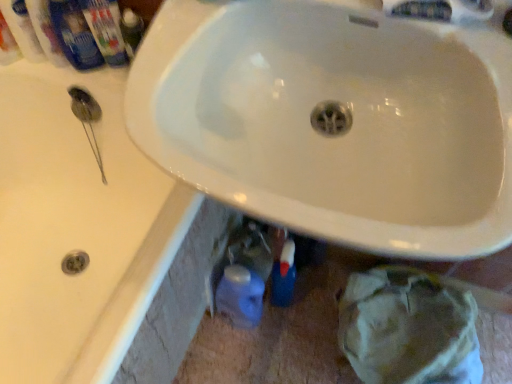
What is the approximate width of white glossy mouthwash at upper left, which is the second mouthwash in left-to-right order?

It is 2.99 inches.

The image size is (512, 384). Describe the element at coordinates (106, 29) in the screenshot. I see `matte plastic toothpaste tube at upper left` at that location.

The height and width of the screenshot is (384, 512). What do you see at coordinates (46, 32) in the screenshot?
I see `blue plastic mouthwash at upper left, the 3th mouthwash from the left` at bounding box center [46, 32].

Find the location of `blue plastic mouthwash at upper left, which ranks as the 2th mouthwash in right-to-left order`. blue plastic mouthwash at upper left, which ranks as the 2th mouthwash in right-to-left order is located at coordinates (46, 32).

Measure the distance between white plastic mouthwash at upper left, the 1th mouthwash when ordered from left to right, and camera.

white plastic mouthwash at upper left, the 1th mouthwash when ordered from left to right, and camera are 33.78 inches apart from each other.

Image resolution: width=512 pixels, height=384 pixels. What do you see at coordinates (7, 44) in the screenshot?
I see `white plastic mouthwash at upper left, the 1th mouthwash when ordered from left to right` at bounding box center [7, 44].

Locate an element on the screen. This screenshot has width=512, height=384. white glossy sink at center is located at coordinates click(340, 134).

In order to click on white glossy mouthwash at upper left, which is the second mouthwash in left-to-right order in this screenshot , I will do `click(23, 30)`.

Based on the photo, is blue plastic mouthwash at upper left, the 3th mouthwash from the left, bigger than blue plastic mouthwash at upper left, which is counted as the first mouthwash, starting from the right?

Correct, blue plastic mouthwash at upper left, the 3th mouthwash from the left, is larger in size than blue plastic mouthwash at upper left, which is counted as the first mouthwash, starting from the right.

Which of these two, blue plastic mouthwash at upper left, which ranks as the 2th mouthwash in right-to-left order, or blue plastic mouthwash at upper left, which appears as the 4th mouthwash when viewed from the left, stands taller?

Standing taller between the two is blue plastic mouthwash at upper left, which appears as the 4th mouthwash when viewed from the left.

Where is `mouthwash that is the 1st one above the blue plastic mouthwash at upper left, which ranks as the 2th mouthwash in right-to-left order (from a real-world perspective)`? The image size is (512, 384). mouthwash that is the 1st one above the blue plastic mouthwash at upper left, which ranks as the 2th mouthwash in right-to-left order (from a real-world perspective) is located at coordinates (74, 35).

How different are the orientations of blue plastic mouthwash at upper left, which ranks as the 2th mouthwash in right-to-left order, and blue plastic mouthwash at upper left, which is counted as the first mouthwash, starting from the right, in degrees?

The angle between the facing direction of blue plastic mouthwash at upper left, which ranks as the 2th mouthwash in right-to-left order, and the facing direction of blue plastic mouthwash at upper left, which is counted as the first mouthwash, starting from the right, is 0.000816 degrees.

Is white glossy sink at upper center oriented away from blue plastic mouthwash at upper left, the 3th mouthwash from the left?

That's not correct — white glossy sink at upper center is not looking away from blue plastic mouthwash at upper left, the 3th mouthwash from the left.

Is white glossy sink at upper center outside of blue plastic mouthwash at upper left, the 3th mouthwash from the left?

Yes.

From the image's perspective, relative to blue plastic mouthwash at upper left, which ranks as the 2th mouthwash in right-to-left order, is white glossy sink at upper center above or below?

white glossy sink at upper center is below blue plastic mouthwash at upper left, which ranks as the 2th mouthwash in right-to-left order.

Is white glossy sink at upper center in contact with blue plastic mouthwash at upper left, the 3th mouthwash from the left?

white glossy sink at upper center and blue plastic mouthwash at upper left, the 3th mouthwash from the left, are not in contact.

Who is more distant, white glossy mouthwash at upper left, the 3th mouthwash when ordered from right to left, or white plastic mouthwash at upper left, the 1th mouthwash when ordered from left to right?

white glossy mouthwash at upper left, the 3th mouthwash when ordered from right to left, is further from the camera.

Considering the positions of objects white glossy mouthwash at upper left, the 3th mouthwash when ordered from right to left, and white plastic mouthwash at upper left, acting as the 4th mouthwash starting from the right, in the image provided, who is more to the left, white glossy mouthwash at upper left, the 3th mouthwash when ordered from right to left, or white plastic mouthwash at upper left, acting as the 4th mouthwash starting from the right,?

white plastic mouthwash at upper left, acting as the 4th mouthwash starting from the right, is more to the left.

Is white glossy mouthwash at upper left, which is the second mouthwash in left-to-right order, bigger than white plastic mouthwash at upper left, the 1th mouthwash when ordered from left to right?

Yes, white glossy mouthwash at upper left, which is the second mouthwash in left-to-right order, is bigger than white plastic mouthwash at upper left, the 1th mouthwash when ordered from left to right.

Is white plastic mouthwash at upper left, acting as the 4th mouthwash starting from the right, positioned beyond the bounds of matte plastic toothpaste tube at upper left?

Yes, white plastic mouthwash at upper left, acting as the 4th mouthwash starting from the right, is not within matte plastic toothpaste tube at upper left.

Between white plastic mouthwash at upper left, acting as the 4th mouthwash starting from the right, and matte plastic toothpaste tube at upper left, which one has larger size?

Bigger between the two is matte plastic toothpaste tube at upper left.

Is white plastic mouthwash at upper left, the 1th mouthwash when ordered from left to right, thinner than matte plastic toothpaste tube at upper left?

Indeed, white plastic mouthwash at upper left, the 1th mouthwash when ordered from left to right, has a lesser width compared to matte plastic toothpaste tube at upper left.

Is white plastic mouthwash at upper left, the 1th mouthwash when ordered from left to right, turned away from matte plastic toothpaste tube at upper left?

white plastic mouthwash at upper left, the 1th mouthwash when ordered from left to right, is not turned away from matte plastic toothpaste tube at upper left.

In the image, is white glossy sink at upper center positioned in front of or behind white glossy mouthwash at upper left, which is the second mouthwash in left-to-right order?

Clearly, white glossy sink at upper center is in front of white glossy mouthwash at upper left, which is the second mouthwash in left-to-right order.

Measure the distance between white glossy sink at upper center and white glossy mouthwash at upper left, which is the second mouthwash in left-to-right order.

They are 13.35 inches apart.

Is white glossy sink at upper center to the left of white glossy mouthwash at upper left, the 3th mouthwash when ordered from right to left, from the viewer's perspective?

No.

Based on the photo, considering the sizes of objects white glossy mouthwash at upper left, which is the second mouthwash in left-to-right order, and white glossy sink at center in the image provided, who is shorter, white glossy mouthwash at upper left, which is the second mouthwash in left-to-right order, or white glossy sink at center?

Standing shorter between the two is white glossy mouthwash at upper left, which is the second mouthwash in left-to-right order.

Is point (12, 1) closer to viewer compared to point (445, 45)?

No, (12, 1) is further to viewer.

Is the surface of white glossy mouthwash at upper left, the 3th mouthwash when ordered from right to left, in direct contact with white glossy sink at center?

No, white glossy mouthwash at upper left, the 3th mouthwash when ordered from right to left, is not in contact with white glossy sink at center.

How different are the orientations of white glossy mouthwash at upper left, the 3th mouthwash when ordered from right to left, and blue plastic mouthwash at upper left, the 3th mouthwash from the left, in degrees?

The facing directions of white glossy mouthwash at upper left, the 3th mouthwash when ordered from right to left, and blue plastic mouthwash at upper left, the 3th mouthwash from the left, are 0.000128 degrees apart.

I want to click on mouthwash lying behind the white glossy mouthwash at upper left, the 3th mouthwash when ordered from right to left, so (x=46, y=32).

Is blue plastic mouthwash at upper left, which ranks as the 2th mouthwash in right-to-left order, at the back of white glossy mouthwash at upper left, which is the second mouthwash in left-to-right order?

No, white glossy mouthwash at upper left, which is the second mouthwash in left-to-right order,'s orientation is not away from blue plastic mouthwash at upper left, which ranks as the 2th mouthwash in right-to-left order.

Does white glossy mouthwash at upper left, which is the second mouthwash in left-to-right order, lie in front of blue plastic mouthwash at upper left, which ranks as the 2th mouthwash in right-to-left order?

Yes, white glossy mouthwash at upper left, which is the second mouthwash in left-to-right order, is closer to the viewer.

You are a GUI agent. You are given a task and a screenshot of the screen. Output one action in this format:
    pyautogui.click(x=<x>, y=<y>)
    Task: Click on the 1st mouthwash counting from the left side of the blue plastic mouthwash at upper left, which appears as the 4th mouthwash when viewed from the left
    The image size is (512, 384).
    Given the screenshot: What is the action you would take?
    pyautogui.click(x=46, y=32)

This screenshot has height=384, width=512. Identify the location of bath directly beneath the blue plastic mouthwash at upper left, the 3th mouthwash from the left (from a real-world perspective). (77, 228).

Based on their spatial positions, is blue plastic mouthwash at upper left, which ranks as the 2th mouthwash in right-to-left order, or matte plastic toothpaste tube at upper left closer to white plastic mouthwash at upper left, the 1th mouthwash when ordered from left to right?

blue plastic mouthwash at upper left, which ranks as the 2th mouthwash in right-to-left order, is positioned closer to the anchor white plastic mouthwash at upper left, the 1th mouthwash when ordered from left to right.

Which object lies nearer to the anchor point blue plastic mouthwash at upper left, the 3th mouthwash from the left, white glossy sink at center or white glossy mouthwash at upper left, the 3th mouthwash when ordered from right to left?

white glossy mouthwash at upper left, the 3th mouthwash when ordered from right to left, is positioned closer to the anchor blue plastic mouthwash at upper left, the 3th mouthwash from the left.

From the image, which object appears to be nearer to blue plastic mouthwash at upper left, which is counted as the first mouthwash, starting from the right, white plastic mouthwash at upper left, the 1th mouthwash when ordered from left to right, or blue plastic mouthwash at upper left, the 3th mouthwash from the left?

blue plastic mouthwash at upper left, the 3th mouthwash from the left, is closer to blue plastic mouthwash at upper left, which is counted as the first mouthwash, starting from the right.

Considering their positions, is matte plastic toothpaste tube at upper left positioned further to white plastic mouthwash at upper left, acting as the 4th mouthwash starting from the right, than blue plastic mouthwash at upper left, which ranks as the 2th mouthwash in right-to-left order?

Based on the image, matte plastic toothpaste tube at upper left appears to be further to white plastic mouthwash at upper left, acting as the 4th mouthwash starting from the right.

Estimate the real-world distances between objects in this image. Which object is further from blue plastic mouthwash at upper left, which ranks as the 2th mouthwash in right-to-left order, blue plastic mouthwash at upper left, which appears as the 4th mouthwash when viewed from the left, or white glossy sink at center?

The object further to blue plastic mouthwash at upper left, which ranks as the 2th mouthwash in right-to-left order, is white glossy sink at center.

Estimate the real-world distances between objects in this image. Which object is further from white plastic mouthwash at upper left, acting as the 4th mouthwash starting from the right, blue plastic mouthwash at upper left, the 3th mouthwash from the left, or white glossy sink at upper center?

white glossy sink at upper center.

Considering their positions, is white glossy mouthwash at upper left, the 3th mouthwash when ordered from right to left, positioned closer to blue plastic mouthwash at upper left, the 3th mouthwash from the left, than white plastic mouthwash at upper left, the 1th mouthwash when ordered from left to right?

white glossy mouthwash at upper left, the 3th mouthwash when ordered from right to left, is closer to blue plastic mouthwash at upper left, the 3th mouthwash from the left.

Based on their spatial positions, is blue plastic mouthwash at upper left, the 3th mouthwash from the left, or white glossy mouthwash at upper left, the 3th mouthwash when ordered from right to left, closer to blue plastic mouthwash at upper left, which is counted as the first mouthwash, starting from the right?

blue plastic mouthwash at upper left, the 3th mouthwash from the left, lies closer to blue plastic mouthwash at upper left, which is counted as the first mouthwash, starting from the right, than the other object.

At what (x,y) coordinates should I click in order to perform the action: click on bath between white glossy mouthwash at upper left, the 3th mouthwash when ordered from right to left, and white glossy sink at center from left to right. Please return your answer as a coordinate pair (x, y). This screenshot has width=512, height=384. Looking at the image, I should click on (77, 228).

What are the coordinates of `bath situated between white plastic mouthwash at upper left, the 1th mouthwash when ordered from left to right, and white glossy sink at center from left to right` in the screenshot? It's located at (77, 228).

This screenshot has height=384, width=512. In order to click on mouthwash between white plastic mouthwash at upper left, acting as the 4th mouthwash starting from the right, and blue plastic mouthwash at upper left, the 3th mouthwash from the left in this screenshot , I will do `click(23, 30)`.

This screenshot has width=512, height=384. Find the location of `toiletry that lies between blue plastic mouthwash at upper left, which appears as the 4th mouthwash when viewed from the left, and white glossy sink at upper center from top to bottom`. toiletry that lies between blue plastic mouthwash at upper left, which appears as the 4th mouthwash when viewed from the left, and white glossy sink at upper center from top to bottom is located at coordinates (106, 29).